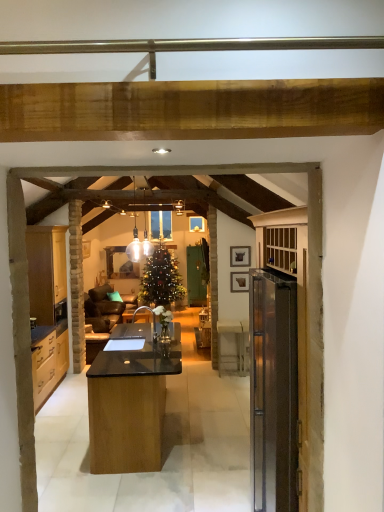
Question: Does white glass pendant light at center have a larger size compared to matte wood cabinets at left?

Choices:
 (A) yes
 (B) no

Answer: (B)

Question: Is white glass pendant light at center not near matte wood cabinets at left?

Choices:
 (A) no
 (B) yes

Answer: (B)

Question: Can we say white glass pendant light at center lies outside matte wood cabinets at left?

Choices:
 (A) yes
 (B) no

Answer: (A)

Question: Considering the relative positions of white glass pendant light at center and matte wood cabinets at left in the image provided, is white glass pendant light at center to the right of matte wood cabinets at left from the viewer's perspective?

Choices:
 (A) yes
 (B) no

Answer: (A)

Question: Is white glass pendant light at center to the left of matte wood cabinets at left from the viewer's perspective?

Choices:
 (A) no
 (B) yes

Answer: (A)

Question: Looking at the image, does wooden picture frame at upper right, the 1th picture frame ordered from the bottom, seem bigger or smaller compared to matte black picture frame at upper center, the 2th picture frame positioned from the bottom?

Choices:
 (A) big
 (B) small

Answer: (A)

Question: In the image, is wooden picture frame at upper right, which is the second picture frame from top to bottom, on the left side or the right side of matte black picture frame at upper center, the 2th picture frame positioned from the bottom?

Choices:
 (A) left
 (B) right

Answer: (B)

Question: Considering the positions of wooden picture frame at upper right, which is the second picture frame from top to bottom, and matte black picture frame at upper center, the 2th picture frame positioned from the bottom, in the image, is wooden picture frame at upper right, which is the second picture frame from top to bottom, taller or shorter than matte black picture frame at upper center, the 2th picture frame positioned from the bottom,?

Choices:
 (A) tall
 (B) short

Answer: (B)

Question: In the image, is wooden picture frame at upper right, the 1th picture frame ordered from the bottom, positioned in front of or behind matte black picture frame at upper center, the 2th picture frame positioned from the bottom?

Choices:
 (A) behind
 (B) front

Answer: (A)

Question: From a real-world perspective, relative to wooden picture frame at upper right, the 1th picture frame ordered from the bottom, is white glass pendant light at center vertically above or below?

Choices:
 (A) below
 (B) above

Answer: (B)

Question: Is point coord(142,248) closer or farther from the camera than point coord(244,290)?

Choices:
 (A) closer
 (B) farther

Answer: (B)

Question: Considering their positions, is white glass pendant light at center located in front of or behind wooden picture frame at upper right, which is the second picture frame from top to bottom?

Choices:
 (A) front
 (B) behind

Answer: (A)

Question: Is white glass pendant light at center inside or outside of wooden picture frame at upper right, the 1th picture frame ordered from the bottom?

Choices:
 (A) outside
 (B) inside

Answer: (A)

Question: Considering the relative positions of wooden picture frame at upper right, which is the second picture frame from top to bottom, and white glass pendant light at center in the image provided, is wooden picture frame at upper right, which is the second picture frame from top to bottom, to the left or to the right of white glass pendant light at center?

Choices:
 (A) left
 (B) right

Answer: (B)

Question: Is wooden picture frame at upper right, the 1th picture frame ordered from the bottom, taller or shorter than white glass pendant light at center?

Choices:
 (A) tall
 (B) short

Answer: (B)